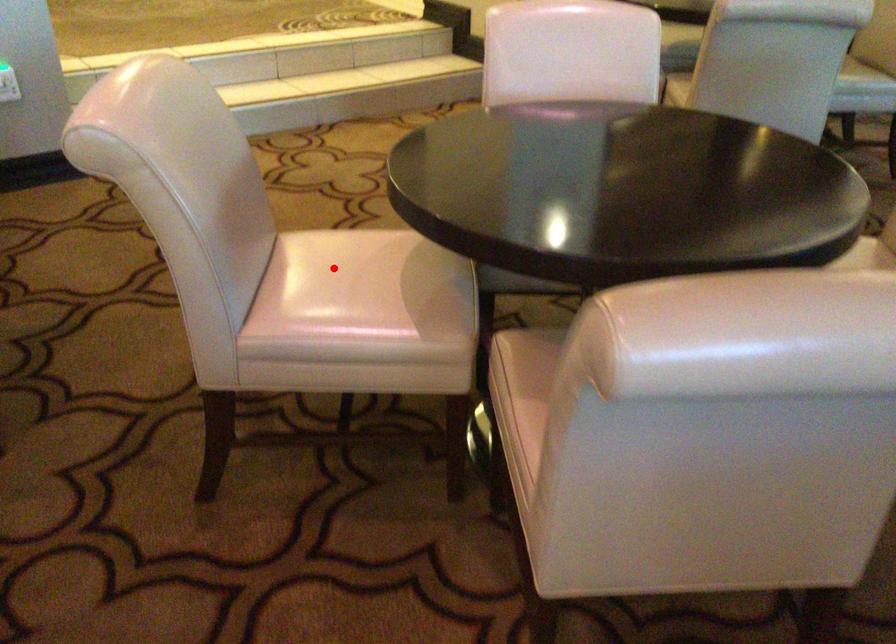
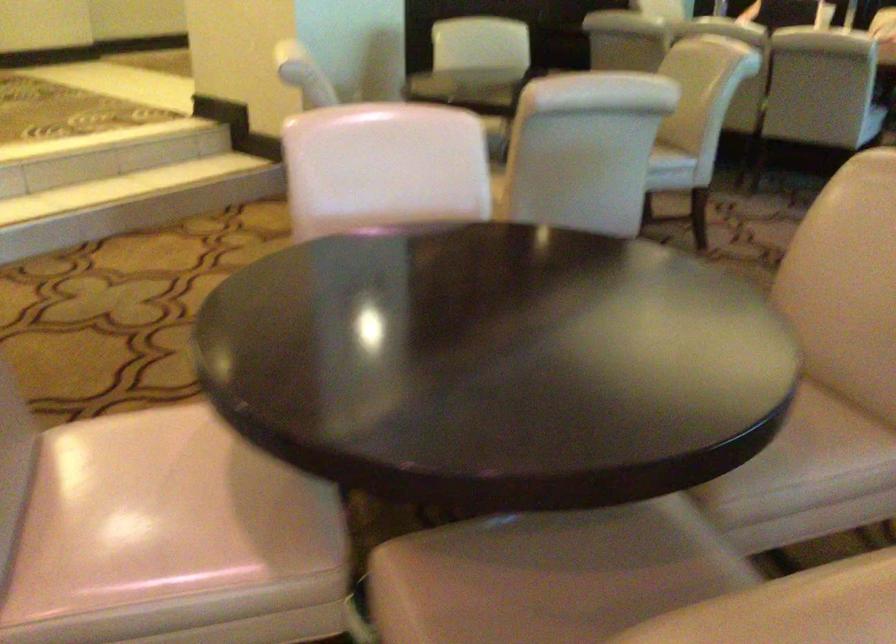
Question: I am providing you with two images of the same scene from different viewpoints. Given a red point in image1, look at the same physical point in image2. Is it:

Choices:
 (A) Closer to the viewpoint
 (B) Farther from the viewpoint

Answer: (A)